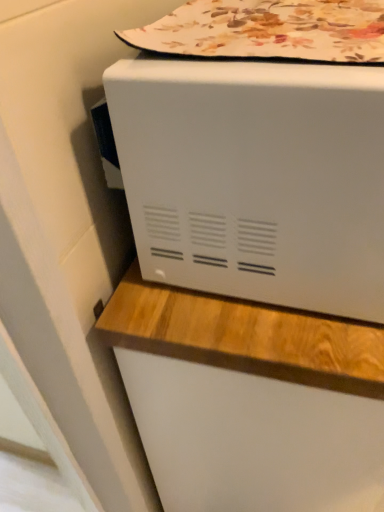
You are a GUI agent. You are given a task and a screenshot of the screen. Output one action in this format:
    pyautogui.click(x=<x>, y=<y>)
    Task: Click on the white matte microwave at upper center
    
    Given the screenshot: What is the action you would take?
    pyautogui.click(x=255, y=179)

The width and height of the screenshot is (384, 512). What do you see at coordinates (255, 179) in the screenshot?
I see `white matte microwave at upper center` at bounding box center [255, 179].

In order to face floral fabric at upper center, should I rotate leftwards or rightwards?

To align with it, rotate right about 12.591°.

In order to click on floral fabric at upper center in this screenshot , I will do `click(268, 30)`.

What do you see at coordinates (268, 30) in the screenshot?
I see `floral fabric at upper center` at bounding box center [268, 30].

This screenshot has width=384, height=512. I want to click on white matte microwave at upper center, so click(x=255, y=179).

Considering the relative positions of floral fabric at upper center and white matte microwave at upper center in the image provided, is floral fabric at upper center to the right of white matte microwave at upper center from the viewer's perspective?

In fact, floral fabric at upper center is to the left of white matte microwave at upper center.

Which object is closer to the camera taking this photo, floral fabric at upper center or white matte microwave at upper center?

white matte microwave at upper center is closer to the camera.

Considering the positions of point (337, 32) and point (245, 97), is point (337, 32) closer or farther from the camera than point (245, 97)?

Point (337, 32) is positioned farther from the camera compared to point (245, 97).

From the image's perspective, is floral fabric at upper center under white matte microwave at upper center?

No, from the image's perspective, floral fabric at upper center is not below white matte microwave at upper center.

From a real-world perspective, is floral fabric at upper center physically located above or below white matte microwave at upper center?

Clearly, from a real-world perspective, floral fabric at upper center is above white matte microwave at upper center.

Is floral fabric at upper center thinner than white matte microwave at upper center?

Yes.

Considering the sizes of objects floral fabric at upper center and white matte microwave at upper center in the image provided, who is shorter, floral fabric at upper center or white matte microwave at upper center?

floral fabric at upper center is shorter.

Who is smaller, floral fabric at upper center or white matte microwave at upper center?

Smaller between the two is floral fabric at upper center.

Is floral fabric at upper center inside the boundaries of white matte microwave at upper center, or outside?

floral fabric at upper center is not inside white matte microwave at upper center, it's outside.

Would you say floral fabric at upper center is a long distance from white matte microwave at upper center?

floral fabric at upper center is near white matte microwave at upper center, not far away.

Is floral fabric at upper center positioned with its back to white matte microwave at upper center?

That's not correct — floral fabric at upper center is not looking away from white matte microwave at upper center.

Can you tell me how much floral fabric at upper center and white matte microwave at upper center differ in facing direction?

They differ by 0.00035 degrees in their facing directions.

Measure the distance from floral fabric at upper center to white matte microwave at upper center.

floral fabric at upper center is 5.37 inches away from white matte microwave at upper center.

In order to click on home appliance below the floral fabric at upper center (from a real-world perspective) in this screenshot , I will do point(255,179).

Which is more to the left, white matte microwave at upper center or floral fabric at upper center?

floral fabric at upper center.

In the scene shown: Is white matte microwave at upper center in front of or behind floral fabric at upper center in the image?

Clearly, white matte microwave at upper center is in front of floral fabric at upper center.

Considering the points (228, 76) and (378, 12), which point is behind, point (228, 76) or point (378, 12)?

Positioned behind is point (378, 12).

From the image's perspective, is white matte microwave at upper center located above or below floral fabric at upper center?

From the image's perspective, white matte microwave at upper center appears below floral fabric at upper center.

From a real-world perspective, which is physically below, white matte microwave at upper center or floral fabric at upper center?

white matte microwave at upper center.

Looking at their sizes, would you say white matte microwave at upper center is wider or thinner than floral fabric at upper center?

Clearly, white matte microwave at upper center has more width compared to floral fabric at upper center.

Who is taller, white matte microwave at upper center or floral fabric at upper center?

white matte microwave at upper center is taller.

Between white matte microwave at upper center and floral fabric at upper center, which one has larger size?

white matte microwave at upper center.

Is white matte microwave at upper center positioned beyond the bounds of floral fabric at upper center?

Yes, white matte microwave at upper center is not within floral fabric at upper center.

Does white matte microwave at upper center touch floral fabric at upper center?

No, white matte microwave at upper center is not next to floral fabric at upper center.

From the picture: Is floral fabric at upper center at the back of white matte microwave at upper center?

white matte microwave at upper center is not turned away from floral fabric at upper center.

Locate an element on the screen. The image size is (384, 512). blanket positioned vertically above the white matte microwave at upper center (from a real-world perspective) is located at coordinates (268, 30).

Identify the location of blanket that appears above the white matte microwave at upper center (from a real-world perspective). (268, 30).

Locate an element on the screen. The image size is (384, 512). blanket behind the white matte microwave at upper center is located at coordinates (268, 30).